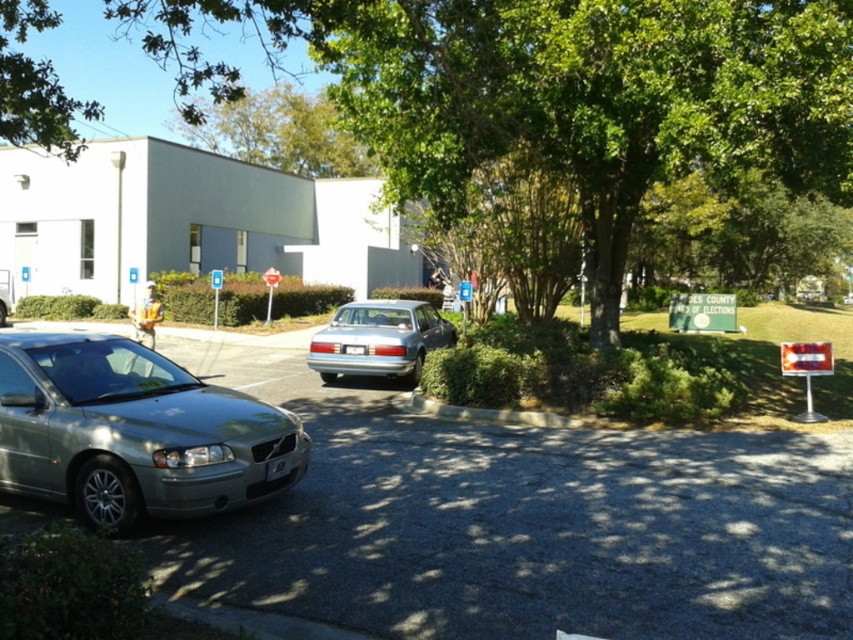
You are a delivery driver who needs to park your truck in the parking lot. The truck requires a space that is at least 10 meters away from any obstacles. Can you safely park your truck between the green leafy tree at center and the satin silver car at lower left?

The distance between the green leafy tree at center and the satin silver car at lower left is 9.16 meters, which is less than the required 10 meters. Therefore, you cannot safely park your truck there as it does not meet the minimum distance requirement.